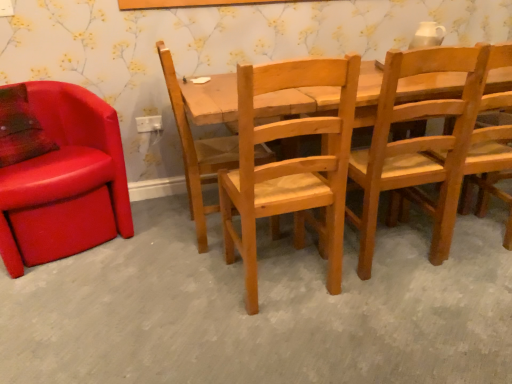
What are the coordinates of `light brown wood chair at right, arranged as the fifth chair when viewed from the left` in the screenshot? It's located at (489, 170).

Where is `natural wood chair at center, placed as the third chair when sorted from left to right`? natural wood chair at center, placed as the third chair when sorted from left to right is located at coordinates (290, 166).

Locate an element on the screen. The height and width of the screenshot is (384, 512). natural wood chair at center, which appears as the fourth chair when viewed from the right is located at coordinates (197, 152).

At what (x,y) coordinates should I click in order to perform the action: click on leather at left, which appears as the 1th chair when viewed from the left. Please return your answer as a coordinate pair (x, y). Looking at the image, I should click on (65, 182).

Identify the location of light brown wood chair at right, arranged as the fifth chair when viewed from the left. This screenshot has width=512, height=384. (489, 170).

Is wooden chair at lower center oriented towards leather at left, which appears as the 1th chair when viewed from the left?

No, wooden chair at lower center is not facing towards leather at left, which appears as the 1th chair when viewed from the left.

Which of these two, wooden chair at lower center or leather at left, which is the fifth chair in right-to-left order, is thinner?

leather at left, which is the fifth chair in right-to-left order, is thinner.

Can you confirm if wooden chair at lower center is shorter than leather at left, which appears as the 1th chair when viewed from the left?

Indeed, wooden chair at lower center has a lesser height compared to leather at left, which appears as the 1th chair when viewed from the left.

Can we say wooden chair at lower center lies outside leather at left, which is the fifth chair in right-to-left order?

Absolutely, wooden chair at lower center is external to leather at left, which is the fifth chair in right-to-left order.

Is light brown wood chair at right, arranged as the fifth chair when viewed from the left, located within natural wood chair at center, which appears as the fourth chair when viewed from the right?

No, light brown wood chair at right, arranged as the fifth chair when viewed from the left, is not surrounded by natural wood chair at center, which appears as the fourth chair when viewed from the right.

Can you tell me how much natural wood chair at center, which appears as the fourth chair when viewed from the right, and light brown wood chair at right, arranged as the fifth chair when viewed from the left, differ in facing direction?

The angle between the facing direction of natural wood chair at center, which appears as the fourth chair when viewed from the right, and the facing direction of light brown wood chair at right, arranged as the fifth chair when viewed from the left, is 85.5 degrees.

From a real-world perspective, is natural wood chair at center, the 2th chair viewed from the left, under light brown wood chair at right, arranged as the fifth chair when viewed from the left?

Incorrect, from a real-world perspective, natural wood chair at center, the 2th chair viewed from the left, is higher than light brown wood chair at right, arranged as the fifth chair when viewed from the left.

Considering the positions of points (205, 206) and (492, 51), is point (205, 206) closer to camera compared to point (492, 51)?

No, (205, 206) is behind (492, 51).

Is white plastic power outlet at center next to light brown wood chair at right, arranged as the fifth chair when viewed from the left, and touching it?

No, white plastic power outlet at center is not beside light brown wood chair at right, arranged as the fifth chair when viewed from the left.

From a real-world perspective, does white plastic power outlet at center stand above light brown wood chair at right, which appears as the 1th chair when viewed from the right?

Correct, in the physical world, white plastic power outlet at center is higher than light brown wood chair at right, which appears as the 1th chair when viewed from the right.

Is wooden chair at center, which is counted as the second chair, starting from the right, bigger than leather at left, which appears as the 1th chair when viewed from the left?

Actually, wooden chair at center, which is counted as the second chair, starting from the right, might be smaller than leather at left, which appears as the 1th chair when viewed from the left.

Between wooden chair at center, positioned as the fourth chair in left-to-right order, and leather at left, which is the fifth chair in right-to-left order, which one is positioned behind?

leather at left, which is the fifth chair in right-to-left order, is further from the camera.

From the leather at left, which is the fifth chair in right-to-left order, count 2nd chairs forward and point to it. Please provide its 2D coordinates.

[(417, 148)]

In the scene shown: How many degrees apart are the facing directions of wooden chair at center, which is counted as the second chair, starting from the right, and leather at left, which appears as the 1th chair when viewed from the left?

The facing directions of wooden chair at center, which is counted as the second chair, starting from the right, and leather at left, which appears as the 1th chair when viewed from the left, are 158 degrees apart.

Is leather at left, which is the fifth chair in right-to-left order, not near wooden chair at lower center?

No, leather at left, which is the fifth chair in right-to-left order, is not far from wooden chair at lower center.

From the image's perspective, relative to wooden chair at lower center, is leather at left, which appears as the 1th chair when viewed from the left, above or below?

Clearly, from the image's perspective, leather at left, which appears as the 1th chair when viewed from the left, is above wooden chair at lower center.

Between leather at left, which appears as the 1th chair when viewed from the left, and wooden chair at lower center, which one is positioned behind?

leather at left, which appears as the 1th chair when viewed from the left, is further from the camera.

Which of these two, natural wood chair at center, which appears as the fourth chair when viewed from the right, or wooden chair at lower center, is bigger?

With larger size is wooden chair at lower center.

How many degrees apart are the facing directions of natural wood chair at center, the 2th chair viewed from the left, and wooden chair at lower center?

They differ by 0.184 degrees in their facing directions.

Would you say wooden chair at lower center is part of natural wood chair at center, which appears as the fourth chair when viewed from the right,'s contents?

No, wooden chair at lower center is not surrounded by natural wood chair at center, which appears as the fourth chair when viewed from the right.

Would you say wooden chair at lower center contains white plastic power outlet at center?

That's incorrect, white plastic power outlet at center is not inside wooden chair at lower center.

From the image's perspective, is wooden chair at lower center located above white plastic power outlet at center?

No, from the image's perspective, wooden chair at lower center is not on top of white plastic power outlet at center.

From a real-world perspective, is wooden chair at lower center below white plastic power outlet at center?

Correct, in the physical world, wooden chair at lower center is lower than white plastic power outlet at center.

In order to click on concrete directly beneath the white plastic power outlet at center (from a real-world perspective) in this screenshot , I will do click(262, 309).

You are a GUI agent. You are given a task and a screenshot of the screen. Output one action in this format:
    pyautogui.click(x=<x>, y=<y>)
    Task: Click on the concrete that is below the leather at left, which is the fifth chair in right-to-left order (from the image's perspective)
    
    Given the screenshot: What is the action you would take?
    pyautogui.click(x=262, y=309)

From the light brown wood chair at right, which appears as the 1th chair when viewed from the right, count 2nd chairs backward and point to it. Please provide its 2D coordinates.

[(197, 152)]

Based on their spatial positions, is wooden chair at center, positioned as the fourth chair in left-to-right order, or white plastic power outlet at center further from light brown wood chair at right, arranged as the fifth chair when viewed from the left?

white plastic power outlet at center.

Which object lies further to the anchor point leather at left, which appears as the 1th chair when viewed from the left, wooden chair at lower center or white plastic power outlet at center?

wooden chair at lower center is positioned further to the anchor leather at left, which appears as the 1th chair when viewed from the left.

Looking at the image, which one is located closer to natural wood chair at center, the 2th chair viewed from the left, light brown wood chair at right, arranged as the fifth chair when viewed from the left, or wooden chair at center, which is counted as the second chair, starting from the right?

wooden chair at center, which is counted as the second chair, starting from the right.

Estimate the real-world distances between objects in this image. Which object is further from light brown wood chair at right, arranged as the fifth chair when viewed from the left, wooden chair at center, which is counted as the second chair, starting from the right, or wooden chair at lower center?

wooden chair at lower center.

Estimate the real-world distances between objects in this image. Which object is further from leather at left, which appears as the 1th chair when viewed from the left, wooden chair at center, positioned as the fourth chair in left-to-right order, or natural wood chair at center, which appears as the fourth chair when viewed from the right?

wooden chair at center, positioned as the fourth chair in left-to-right order, lies further to leather at left, which appears as the 1th chair when viewed from the left, than the other object.

Which object lies nearer to the anchor point leather at left, which is the fifth chair in right-to-left order, natural wood chair at center, the 2th chair viewed from the left, or white plastic power outlet at center?

natural wood chair at center, the 2th chair viewed from the left, is positioned closer to the anchor leather at left, which is the fifth chair in right-to-left order.

When comparing their distances from natural wood chair at center, the 2th chair viewed from the left, does leather at left, which appears as the 1th chair when viewed from the left, or natural wood chair at center, placed as the third chair when sorted from left to right, seem closer?

natural wood chair at center, placed as the third chair when sorted from left to right, is closer to natural wood chair at center, the 2th chair viewed from the left.

When comparing their distances from natural wood chair at center, which appears as the fourth chair when viewed from the right, does leather at left, which appears as the 1th chair when viewed from the left, or light brown wood chair at right, arranged as the fifth chair when viewed from the left, seem further?

The object further to natural wood chair at center, which appears as the fourth chair when viewed from the right, is light brown wood chair at right, arranged as the fifth chair when viewed from the left.

Image resolution: width=512 pixels, height=384 pixels. Find the location of `chair between natural wood chair at center, which appears as the fourth chair when viewed from the right, and wooden chair at center, positioned as the fourth chair in left-to-right order`. chair between natural wood chair at center, which appears as the fourth chair when viewed from the right, and wooden chair at center, positioned as the fourth chair in left-to-right order is located at coordinates (290, 166).

The height and width of the screenshot is (384, 512). In order to click on concrete between natural wood chair at center, which is the third chair in right-to-left order, and light brown wood chair at right, which appears as the 1th chair when viewed from the right, from left to right in this screenshot , I will do pos(262,309).

Where is `chair located between leather at left, which is the fifth chair in right-to-left order, and white plastic power outlet at center in the depth direction`? The height and width of the screenshot is (384, 512). chair located between leather at left, which is the fifth chair in right-to-left order, and white plastic power outlet at center in the depth direction is located at coordinates 197,152.

Where is `concrete situated between white plastic power outlet at center and light brown wood chair at right, arranged as the fifth chair when viewed from the left, from left to right`? This screenshot has width=512, height=384. concrete situated between white plastic power outlet at center and light brown wood chair at right, arranged as the fifth chair when viewed from the left, from left to right is located at coordinates (262, 309).